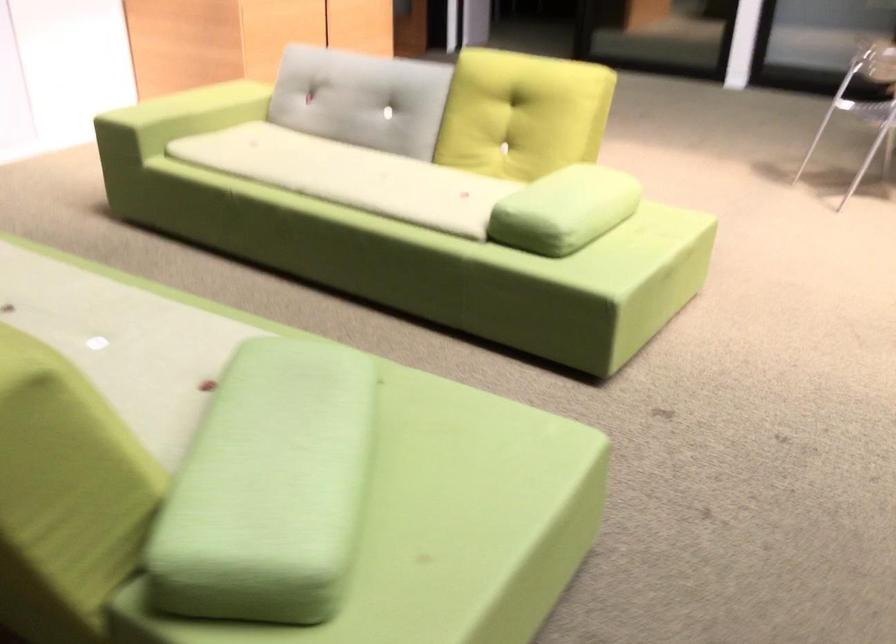
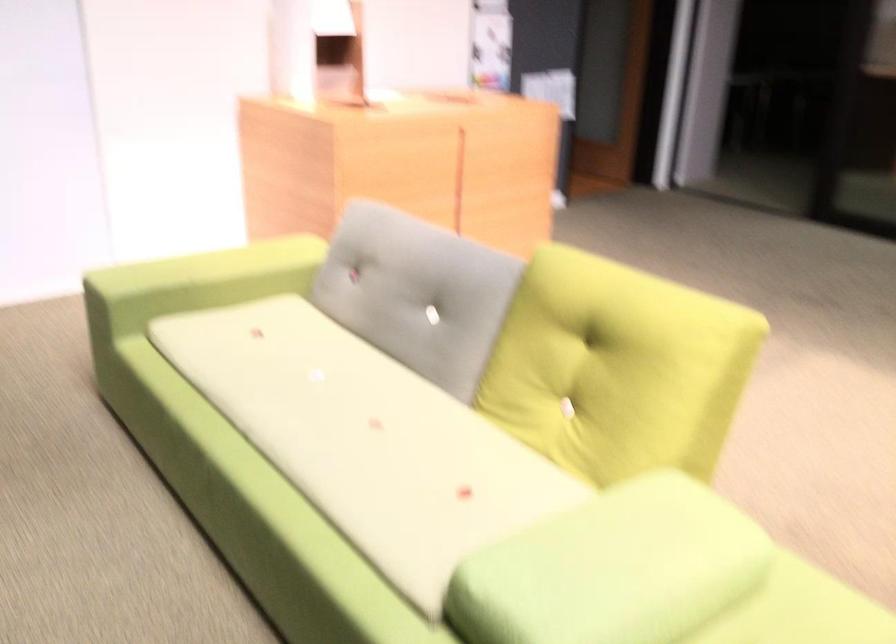
In the second image, find the point that corresponds to point (388, 178) in the first image.

(366, 439)